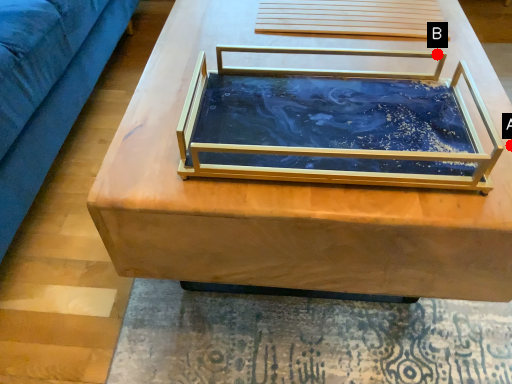
Question: Two points are circled on the image, labeled by A and B beside each circle. Which of the following is the closest to the observer?

Choices:
 (A) A is closer
 (B) B is closer

Answer: (A)